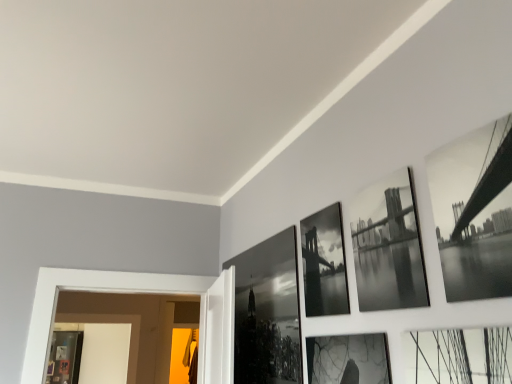
Image resolution: width=512 pixels, height=384 pixels. What do you see at coordinates (388, 246) in the screenshot?
I see `black glossy photo frame at upper center, the second picture frame viewed from the front` at bounding box center [388, 246].

In order to face black glossy photo frame at center, arranged as the fourth picture frame when viewed from the front, should I rotate leftwards or rightwards?

Turn left approximately 0.156 degrees to face it.

Where is `black glossy bridge at upper right, which is the first picture frame in front-to-back order`? The image size is (512, 384). black glossy bridge at upper right, which is the first picture frame in front-to-back order is located at coordinates (474, 212).

This screenshot has height=384, width=512. Identify the location of black glossy photo frame at upper center, positioned as the 3th picture frame in left-to-right order. (388, 246).

Is black glossy photo frame at center, acting as the third picture frame starting from the right, far from black glossy photo frame at upper center, which is counted as the third picture frame, starting from the back?

No, black glossy photo frame at center, acting as the third picture frame starting from the right, is not far from black glossy photo frame at upper center, which is counted as the third picture frame, starting from the back.

From a real-world perspective, does black glossy photo frame at center, the 2th picture frame in the left-to-right sequence, stand above black glossy photo frame at upper center, which is counted as the third picture frame, starting from the back?

Yes, from a real-world perspective, black glossy photo frame at center, the 2th picture frame in the left-to-right sequence, is over black glossy photo frame at upper center, which is counted as the third picture frame, starting from the back

Is black glossy photo frame at center, acting as the third picture frame starting from the right, taller or shorter than black glossy photo frame at upper center, which is counted as the third picture frame, starting from the back?

Clearly, black glossy photo frame at center, acting as the third picture frame starting from the right, is taller compared to black glossy photo frame at upper center, which is counted as the third picture frame, starting from the back.

Find the location of a particular element. The image size is (512, 384). the 2nd picture frame above the black glossy photo frame at upper center, positioned as the 3th picture frame in left-to-right order (from a real-world perspective) is located at coordinates (474, 212).

From the image's perspective, which is above, black glossy photo frame at upper center, the 2th picture frame positioned from the right, or black glossy bridge at upper right, acting as the first picture frame starting from the right?

black glossy bridge at upper right, acting as the first picture frame starting from the right, appears higher in the image.

Does black glossy photo frame at upper center, the second picture frame viewed from the front, come behind black glossy bridge at upper right, which is the first picture frame in front-to-back order?

Yes, black glossy photo frame at upper center, the second picture frame viewed from the front, is further from the camera.

Is black glossy photo frame at upper center, the second picture frame viewed from the front, placed right next to black glossy bridge at upper right, which is the first picture frame in front-to-back order?

No, black glossy photo frame at upper center, the second picture frame viewed from the front, is not touching black glossy bridge at upper right, which is the first picture frame in front-to-back order.

From the image's perspective, does black glossy bridge at upper right, the fourth picture frame when ordered from back to front, appear higher than black glossy photo frame at center, the 4th picture frame when ordered from right to left?

Yes, from the image's perspective, black glossy bridge at upper right, the fourth picture frame when ordered from back to front, is on top of black glossy photo frame at center, the 4th picture frame when ordered from right to left.

You are a GUI agent. You are given a task and a screenshot of the screen. Output one action in this format:
    pyautogui.click(x=<x>, y=<y>)
    Task: Click on the 3rd picture frame above the black glossy photo frame at center, arranged as the first picture frame when viewed from the back (from a real-world perspective)
    Image resolution: width=512 pixels, height=384 pixels.
    Given the screenshot: What is the action you would take?
    pyautogui.click(x=474, y=212)

Are black glossy bridge at upper right, the fourth picture frame when ordered from back to front, and black glossy photo frame at center, acting as the 1th picture frame starting from the left, far apart?

No.

Looking at this image, considering the relative positions of black glossy bridge at upper right, the fourth picture frame when ordered from back to front, and black glossy photo frame at center, acting as the 1th picture frame starting from the left, in the image provided, is black glossy bridge at upper right, the fourth picture frame when ordered from back to front, behind black glossy photo frame at center, acting as the 1th picture frame starting from the left,?

No, it is not.

Does black glossy photo frame at upper center, which is counted as the third picture frame, starting from the back, turn towards black glossy photo frame at center, the 2th picture frame when ordered from back to front?

No, black glossy photo frame at upper center, which is counted as the third picture frame, starting from the back, is not aimed at black glossy photo frame at center, the 2th picture frame when ordered from back to front.

How far apart are black glossy photo frame at upper center, which is counted as the third picture frame, starting from the back, and black glossy photo frame at center, the 2th picture frame when ordered from back to front?

black glossy photo frame at upper center, which is counted as the third picture frame, starting from the back, and black glossy photo frame at center, the 2th picture frame when ordered from back to front, are 6.87 inches apart.

Considering the relative sizes of black glossy photo frame at upper center, the 2th picture frame positioned from the right, and black glossy photo frame at center, which appears as the third picture frame when viewed from the front, in the image provided, is black glossy photo frame at upper center, the 2th picture frame positioned from the right, shorter than black glossy photo frame at center, which appears as the third picture frame when viewed from the front,?

Yes, black glossy photo frame at upper center, the 2th picture frame positioned from the right, is shorter than black glossy photo frame at center, which appears as the third picture frame when viewed from the front.

Considering the relative sizes of black glossy photo frame at center, acting as the 1th picture frame starting from the left, and black glossy bridge at upper right, acting as the first picture frame starting from the right, in the image provided, is black glossy photo frame at center, acting as the 1th picture frame starting from the left, bigger than black glossy bridge at upper right, acting as the first picture frame starting from the right,?

Correct, black glossy photo frame at center, acting as the 1th picture frame starting from the left, is larger in size than black glossy bridge at upper right, acting as the first picture frame starting from the right.

Looking at their sizes, would you say black glossy photo frame at center, the 4th picture frame when ordered from right to left, is wider or thinner than black glossy bridge at upper right, arranged as the fourth picture frame when viewed from the left?

Considering their sizes, black glossy photo frame at center, the 4th picture frame when ordered from right to left, looks slimmer than black glossy bridge at upper right, arranged as the fourth picture frame when viewed from the left.

Which is behind, point (270, 279) or point (508, 274)?

The point (270, 279) is behind.

Which is more to the right, black glossy photo frame at center, arranged as the fourth picture frame when viewed from the front, or black glossy bridge at upper right, acting as the first picture frame starting from the right?

From the viewer's perspective, black glossy bridge at upper right, acting as the first picture frame starting from the right, appears more on the right side.

Is black glossy photo frame at center, the 2th picture frame in the left-to-right sequence, at the back of black glossy bridge at upper right, which is the first picture frame in front-to-back order?

No, black glossy bridge at upper right, which is the first picture frame in front-to-back order,'s orientation is not away from black glossy photo frame at center, the 2th picture frame in the left-to-right sequence.

Considering the sizes of black glossy bridge at upper right, acting as the first picture frame starting from the right, and black glossy photo frame at center, the 2th picture frame when ordered from back to front, in the image, is black glossy bridge at upper right, acting as the first picture frame starting from the right, taller or shorter than black glossy photo frame at center, the 2th picture frame when ordered from back to front,?

Considering their sizes, black glossy bridge at upper right, acting as the first picture frame starting from the right, has less height than black glossy photo frame at center, the 2th picture frame when ordered from back to front.

Considering the positions of objects black glossy bridge at upper right, acting as the first picture frame starting from the right, and black glossy photo frame at center, acting as the third picture frame starting from the right, in the image provided, who is in front, black glossy bridge at upper right, acting as the first picture frame starting from the right, or black glossy photo frame at center, acting as the third picture frame starting from the right,?

black glossy bridge at upper right, acting as the first picture frame starting from the right, is closer to the camera.

From the image's perspective, count 2nd picture frames downward from the black glossy photo frame at upper center, the second picture frame viewed from the front, and point to it. Please provide its 2D coordinates.

[(267, 312)]

Can you confirm if black glossy photo frame at center, acting as the 1th picture frame starting from the left, is bigger than black glossy photo frame at upper center, positioned as the 3th picture frame in left-to-right order?

Indeed, black glossy photo frame at center, acting as the 1th picture frame starting from the left, has a larger size compared to black glossy photo frame at upper center, positioned as the 3th picture frame in left-to-right order.

Consider the image. What's the angular difference between black glossy photo frame at center, acting as the 1th picture frame starting from the left, and black glossy photo frame at upper center, which is counted as the third picture frame, starting from the back,'s facing directions?

The angle between the facing direction of black glossy photo frame at center, acting as the 1th picture frame starting from the left, and the facing direction of black glossy photo frame at upper center, which is counted as the third picture frame, starting from the back, is 0.000703 degrees.

Between point (245, 292) and point (359, 195), which one is positioned behind?

The point (245, 292) is more distant.

This screenshot has height=384, width=512. I want to click on picture frame that is the 1st one when counting backward from the black glossy photo frame at upper center, which is counted as the third picture frame, starting from the back, so 324,263.

At what (x,y) coordinates should I click in order to perform the action: click on the 1st picture frame below when counting from the black glossy bridge at upper right, arranged as the fourth picture frame when viewed from the left (from the image's perspective). Please return your answer as a coordinate pair (x, y). The height and width of the screenshot is (384, 512). Looking at the image, I should click on (388, 246).

From the image, which object appears to be nearer to black glossy bridge at upper right, the fourth picture frame when ordered from back to front, black glossy photo frame at upper center, the second picture frame viewed from the front, or black glossy photo frame at center, which appears as the third picture frame when viewed from the front?

black glossy photo frame at upper center, the second picture frame viewed from the front, is closer to black glossy bridge at upper right, the fourth picture frame when ordered from back to front.

Which object lies nearer to the anchor point black glossy photo frame at upper center, the 2th picture frame positioned from the right, black glossy photo frame at center, which appears as the third picture frame when viewed from the front, or black glossy photo frame at center, arranged as the first picture frame when viewed from the back?

black glossy photo frame at center, which appears as the third picture frame when viewed from the front.

Estimate the real-world distances between objects in this image. Which object is closer to black glossy photo frame at center, the 2th picture frame when ordered from back to front, black glossy photo frame at upper center, the 2th picture frame positioned from the right, or black glossy bridge at upper right, which is the first picture frame in front-to-back order?

black glossy photo frame at upper center, the 2th picture frame positioned from the right.

From the image, which object appears to be farther from black glossy photo frame at center, the 2th picture frame in the left-to-right sequence, black glossy photo frame at upper center, which is counted as the third picture frame, starting from the back, or black glossy photo frame at center, acting as the 1th picture frame starting from the left?

The object further to black glossy photo frame at center, the 2th picture frame in the left-to-right sequence, is black glossy photo frame at center, acting as the 1th picture frame starting from the left.

Estimate the real-world distances between objects in this image. Which object is closer to black glossy photo frame at center, which appears as the third picture frame when viewed from the front, black glossy photo frame at center, acting as the 1th picture frame starting from the left, or black glossy photo frame at upper center, the 2th picture frame positioned from the right?

black glossy photo frame at upper center, the 2th picture frame positioned from the right.

Considering their positions, is black glossy bridge at upper right, arranged as the fourth picture frame when viewed from the left, positioned closer to black glossy photo frame at center, the 2th picture frame in the left-to-right sequence, than black glossy photo frame at center, acting as the 1th picture frame starting from the left?

black glossy photo frame at center, acting as the 1th picture frame starting from the left, is closer to black glossy photo frame at center, the 2th picture frame in the left-to-right sequence.

Looking at the image, which one is located further to black glossy photo frame at center, the 4th picture frame when ordered from right to left, black glossy photo frame at center, the 2th picture frame when ordered from back to front, or black glossy photo frame at upper center, the second picture frame viewed from the front?

The object further to black glossy photo frame at center, the 4th picture frame when ordered from right to left, is black glossy photo frame at upper center, the second picture frame viewed from the front.

Considering their positions, is black glossy photo frame at center, which appears as the third picture frame when viewed from the front, positioned further to black glossy photo frame at center, arranged as the fourth picture frame when viewed from the front, than black glossy bridge at upper right, arranged as the fourth picture frame when viewed from the left?

Among the two, black glossy bridge at upper right, arranged as the fourth picture frame when viewed from the left, is located further to black glossy photo frame at center, arranged as the fourth picture frame when viewed from the front.

Identify the location of picture frame between black glossy photo frame at upper center, the 2th picture frame positioned from the right, and black glossy photo frame at center, arranged as the fourth picture frame when viewed from the front, in the front-back direction. This screenshot has height=384, width=512. (324, 263).

Where is `picture frame between black glossy bridge at upper right, which is the first picture frame in front-to-back order, and black glossy photo frame at center, the 2th picture frame when ordered from back to front, from front to back`? picture frame between black glossy bridge at upper right, which is the first picture frame in front-to-back order, and black glossy photo frame at center, the 2th picture frame when ordered from back to front, from front to back is located at coordinates (388, 246).